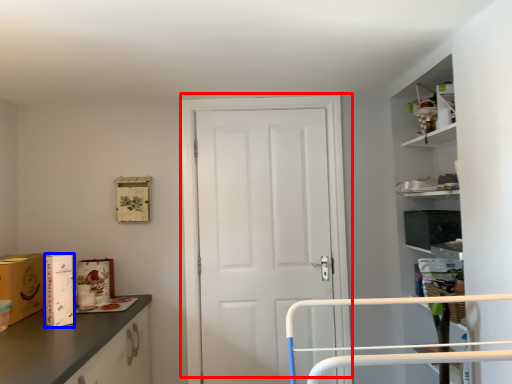
Question: Which object is closer to the camera taking this photo, door (highlighted by a red box) or cardboard box (highlighted by a blue box)?

Choices:
 (A) door
 (B) cardboard box

Answer: (B)